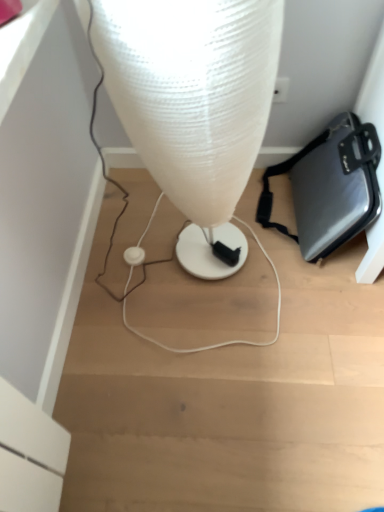
What are the coordinates of `vacant area situated to the left side of translucent plastic lamp at center` in the screenshot? It's located at (122, 274).